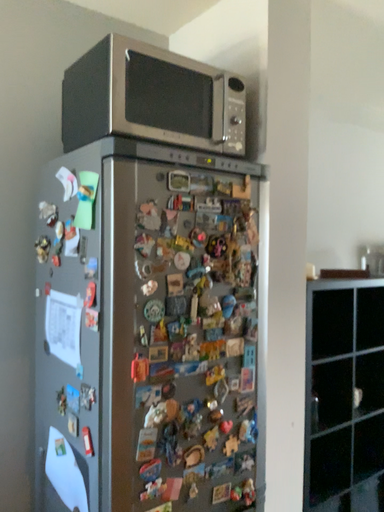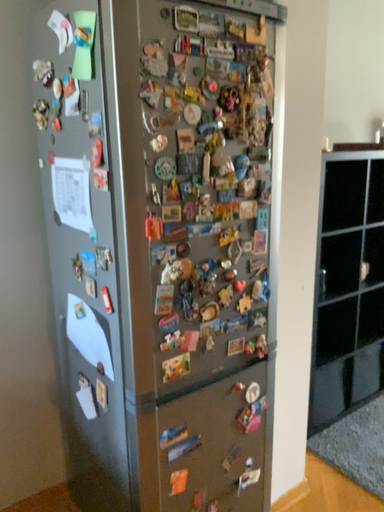
Question: Which way did the camera rotate in the video?

Choices:
 (A) rotated downward
 (B) rotated upward

Answer: (A)